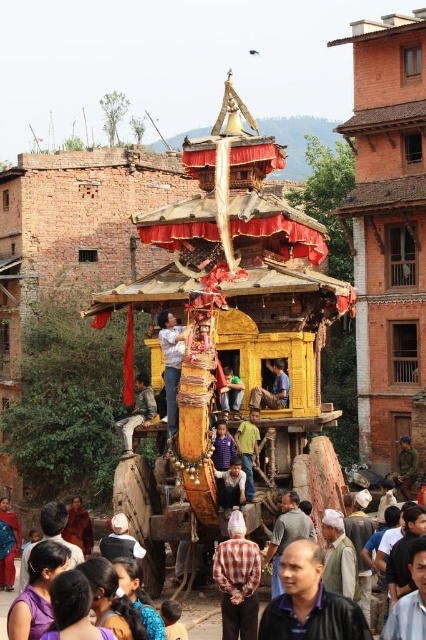
You are a photographer at the festival and want to capture both the blue fabric at center and the yellow wooden person at center in a single frame. Which object should you focus on first to ensure both are in the shot?

The blue fabric at center is larger in size than the yellow wooden person at center, so focusing on the blue fabric at center first will help ensure both objects are captured in the frame.

You are a festival attendee holding a 1 meter long pole. You want to place the pole between the blue fabric at center and the yellow wooden person at center. Is there enough space to fit the pole horizontally between them?

The distance between the blue fabric at center and the yellow wooden person at center is 1.12 meters. Since the pole is 1 meter long, there is enough space to fit it horizontally between them as the distance is greater than the pole length.